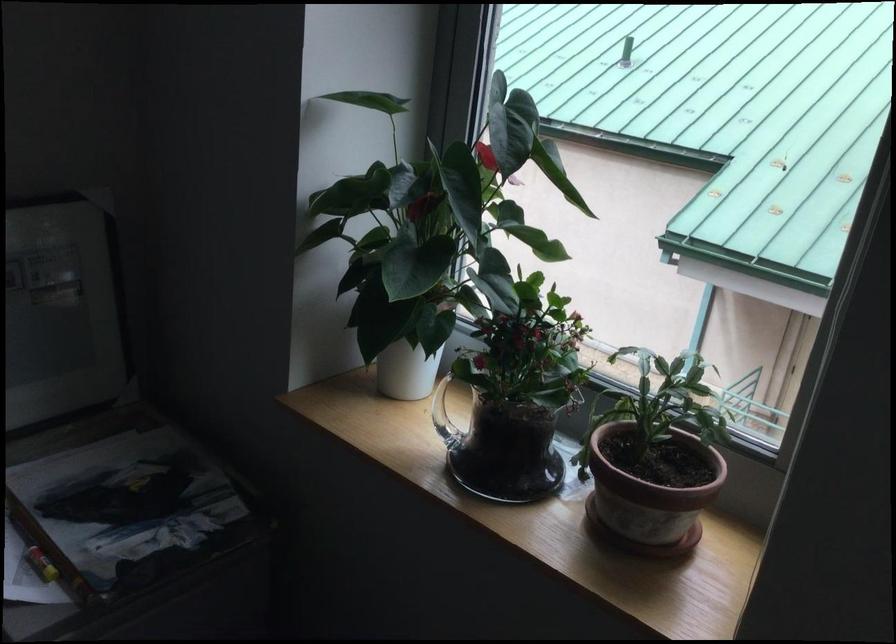
What do you see at coordinates (440, 402) in the screenshot?
I see `the glass pitcher handle` at bounding box center [440, 402].